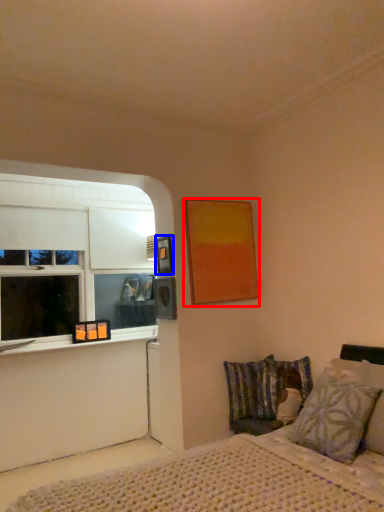
Question: Which point is closer to the camera, picture frame (highlighted by a red box) or picture frame (highlighted by a blue box)?

Choices:
 (A) picture frame
 (B) picture frame

Answer: (A)